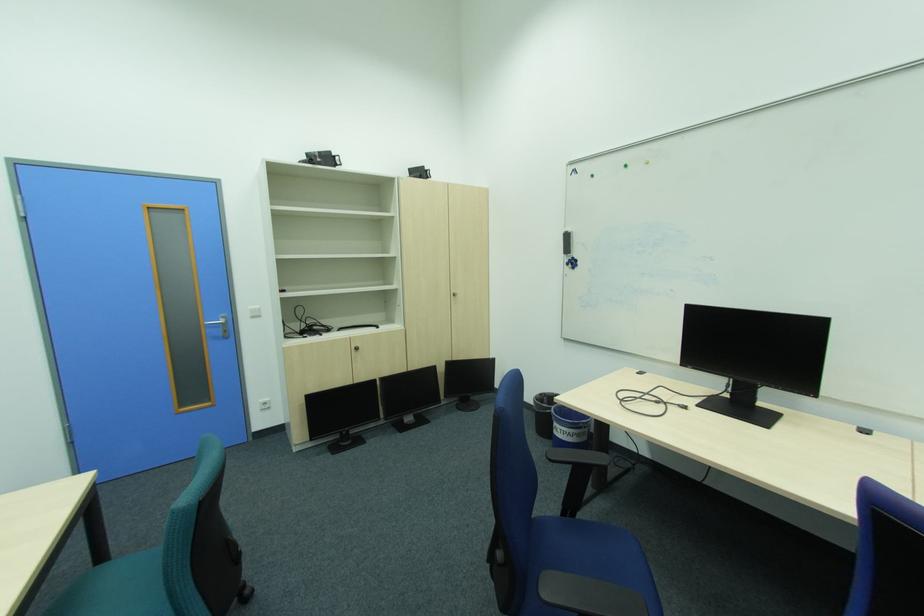
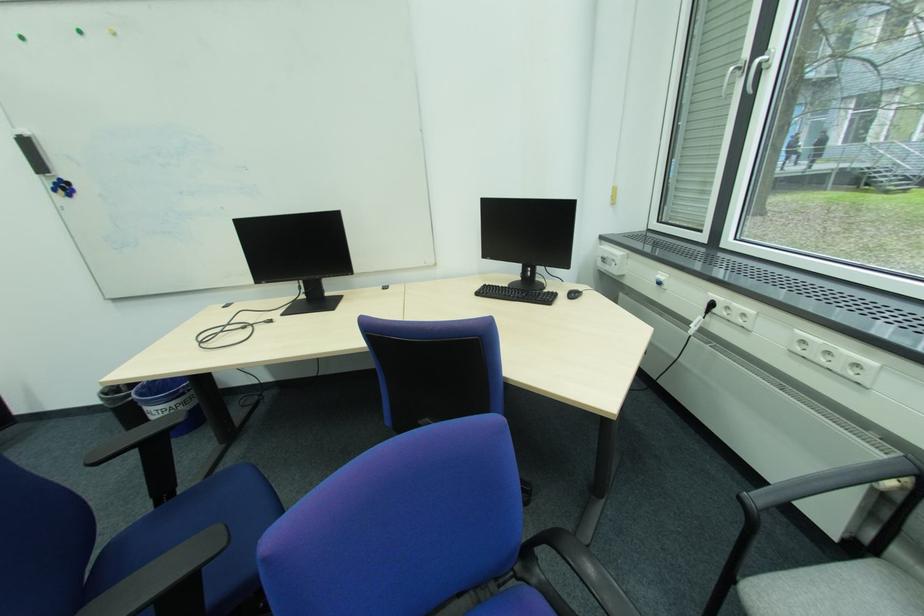
Locate, in the second image, the point that corresponds to point 577,261 in the first image.

(62, 185)